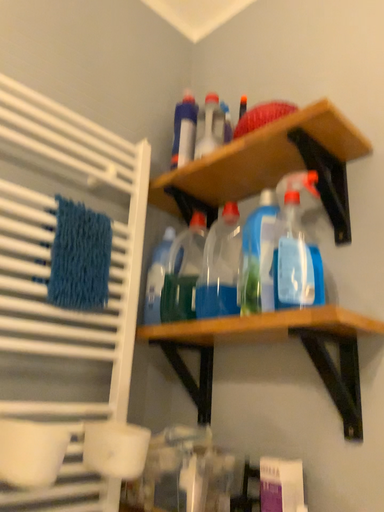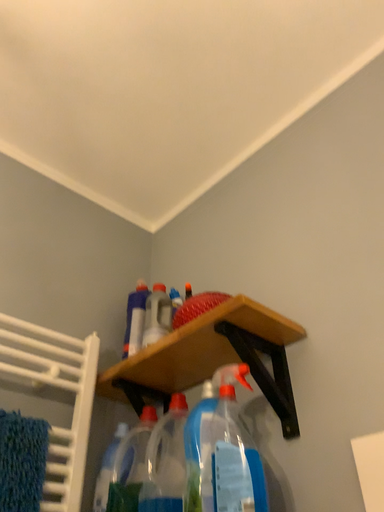
Question: Which way did the camera rotate in the video?

Choices:
 (A) rotated downward
 (B) rotated upward

Answer: (B)